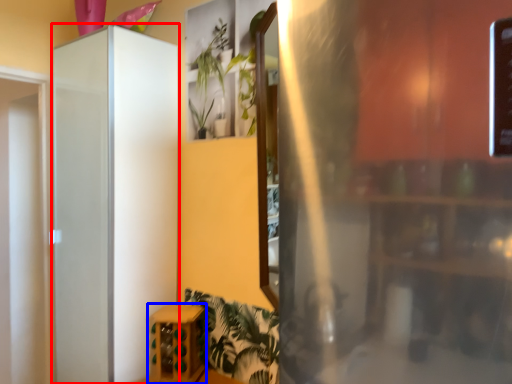
Question: Which object appears closest to the camera in this image, screen door (highlighted by a red box) or furniture (highlighted by a blue box)?

Choices:
 (A) screen door
 (B) furniture

Answer: (A)